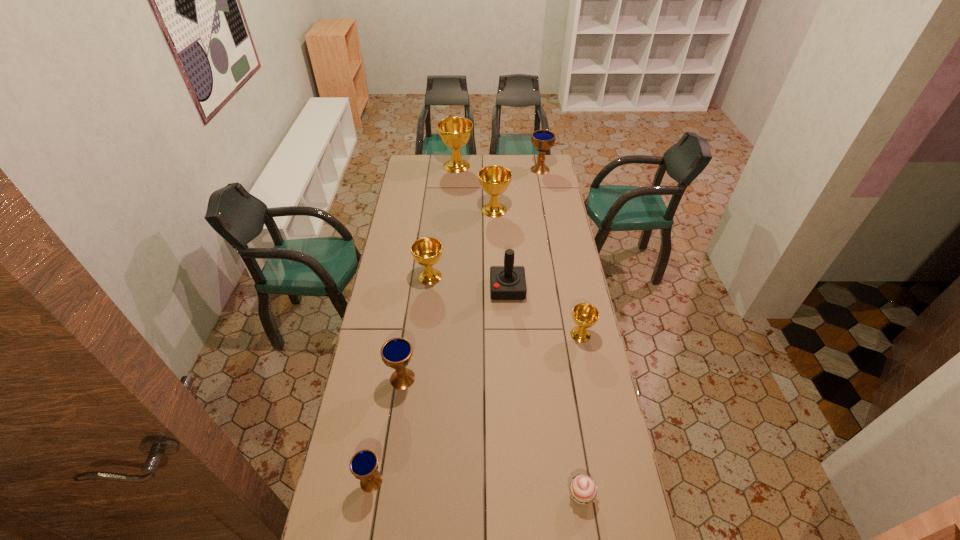
Locate an element on the screen. The height and width of the screenshot is (540, 960). free space between the third farthest chalice and the farthest gold chalice is located at coordinates (475, 188).

This screenshot has width=960, height=540. What are the coordinates of `vacant space that is in between the fifth farthest chalice and the rightmost blue chalice` in the screenshot? It's located at [x=561, y=252].

Image resolution: width=960 pixels, height=540 pixels. Find the location of `the second closest object to the smallest gold chalice`. the second closest object to the smallest gold chalice is located at coordinates (583, 489).

Locate which object ranks fifth in proximity to the red joystick. Please provide its 2D coordinates. Your answer should be formatted as a tuple, i.e. [(x, y)], where the tuple contains the x and y coordinates of a point satisfying the conditions above.

[(583, 489)]

In order to click on the fifth closest chalice relative to the rightmost blue chalice in this screenshot , I will do `click(396, 353)`.

Identify which chalice is located as the nearest to the rightmost blue chalice. Please provide its 2D coordinates. Your answer should be formatted as a tuple, i.e. [(x, y)], where the tuple contains the x and y coordinates of a point satisfying the conditions above.

[(494, 180)]

I want to click on gold chalice that is the third closest to the farthest gold chalice, so click(585, 315).

Image resolution: width=960 pixels, height=540 pixels. Find the location of `the second closest gold chalice relative to the fourth farthest chalice`. the second closest gold chalice relative to the fourth farthest chalice is located at coordinates (585, 315).

Image resolution: width=960 pixels, height=540 pixels. Find the location of `blue chalice object that ranks as the third closest to the nearest gold chalice`. blue chalice object that ranks as the third closest to the nearest gold chalice is located at coordinates (x=543, y=140).

Image resolution: width=960 pixels, height=540 pixels. Identify the location of the closest blue chalice to the tallest chalice. (543, 140).